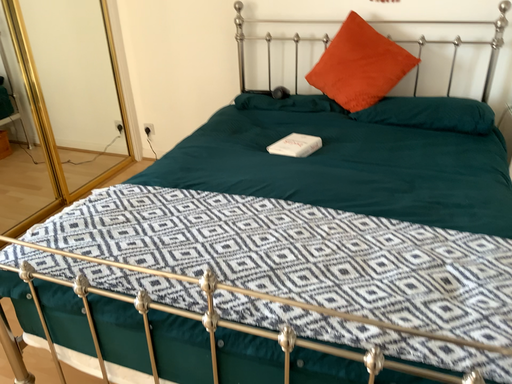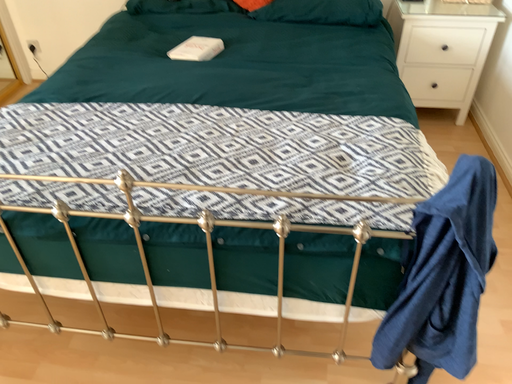
Question: Which way did the camera rotate in the video?

Choices:
 (A) rotated left
 (B) rotated right

Answer: (B)